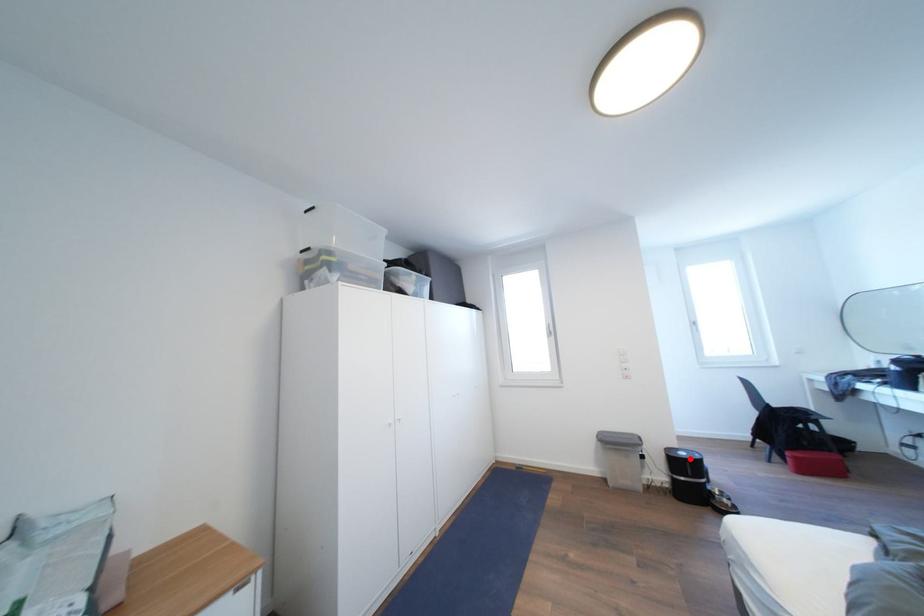
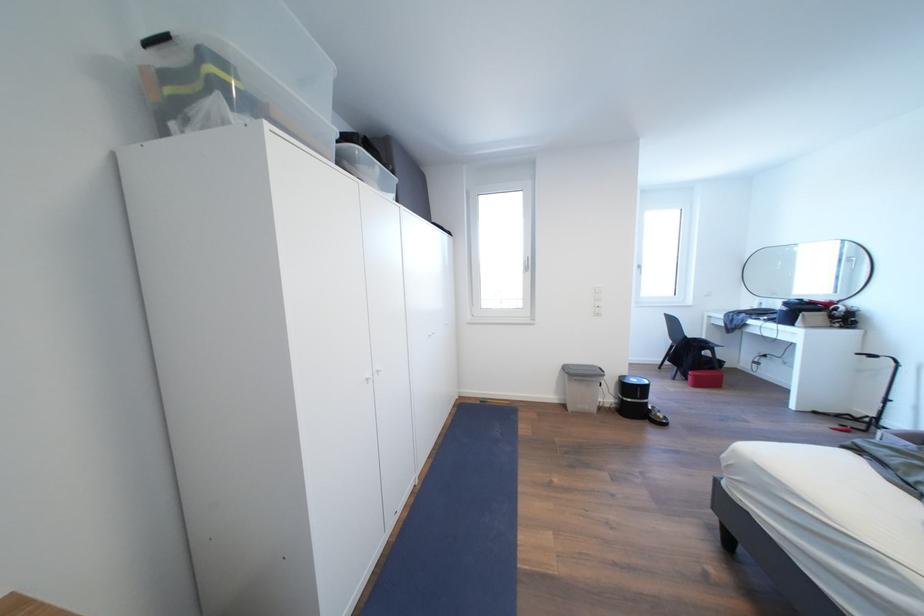
In the second image, find the point that corresponds to the highlighted location in the first image.

(641, 386)